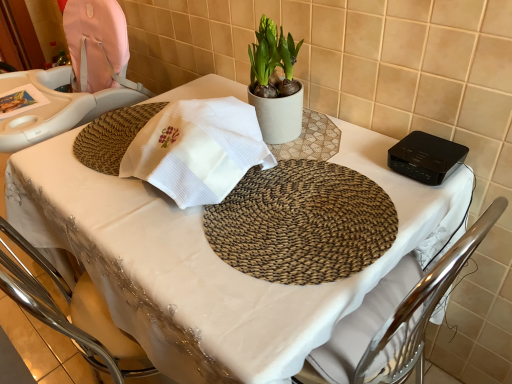
The width and height of the screenshot is (512, 384). What are the coordinates of `free space to the left of black plastic device at upper right` in the screenshot? It's located at (355, 155).